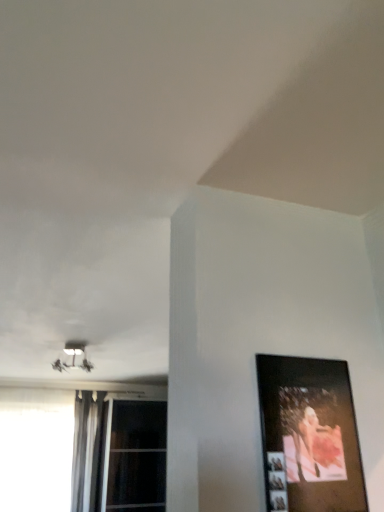
Question: From a real-world perspective, is white plastic lamp at upper left physically located above or below silky gray curtain at left?

Choices:
 (A) above
 (B) below

Answer: (A)

Question: Is white plastic lamp at upper left in front of or behind silky gray curtain at left in the image?

Choices:
 (A) front
 (B) behind

Answer: (A)

Question: Estimate the real-world distances between objects in this image. Which object is farther from the wooden picture frame at right?

Choices:
 (A) silky gray curtain at left
 (B) white glass window at lower left, the second window from the right
 (C) white plastic lamp at upper left
 (D) transparent glass window at lower left, which is the second window from left to right

Answer: (D)

Question: Estimate the real-world distances between objects in this image. Which object is farther from the silky gray curtain at left?

Choices:
 (A) wooden picture frame at right
 (B) white plastic lamp at upper left
 (C) transparent glass window at lower left, acting as the 1th window starting from the right
 (D) white glass window at lower left, the first window positioned from the left

Answer: (A)